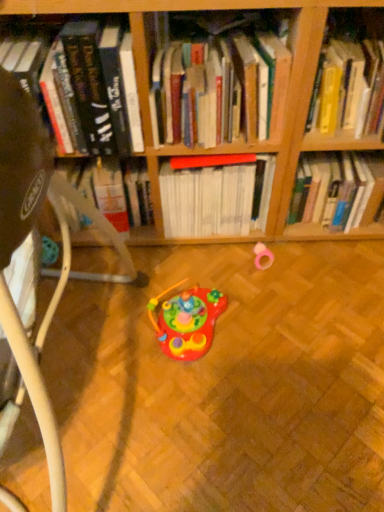
You are a GUI agent. You are given a task and a screenshot of the screen. Output one action in this format:
    pyautogui.click(x=<x>, y=<y>)
    Task: Click on the vacant space behind shiny plastic toy at center, which is counted as the 2th toy, starting from the top
    
    Given the screenshot: What is the action you would take?
    pyautogui.click(x=192, y=266)